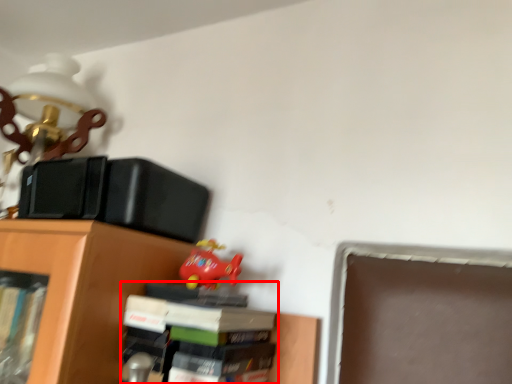
Question: From the image's perspective, what is the correct spatial relationship of book (annotated by the red box) in relation to toy?

Choices:
 (A) above
 (B) below

Answer: (B)